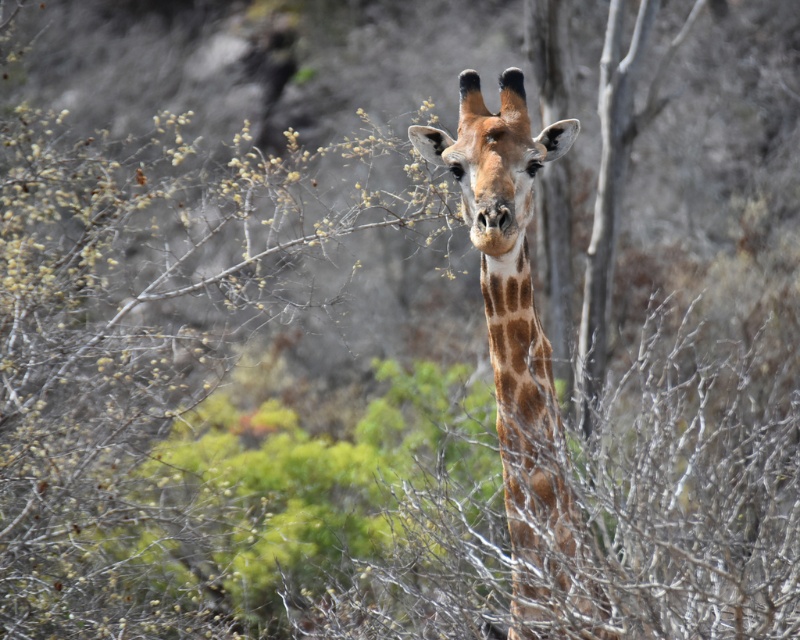
You are a wildlife photographer aiming to capture a closeup shot of the spotted fur giraffe head at center and the brown spotted neck at center. Given that your camera has a maximum focus range of 8 inches, will you be able to focus on both subjects simultaneously?

The spotted fur giraffe head at center and brown spotted neck at center are 8.18 inches apart. Since the distance between them exceeds the camera maximum focus range of 8 inches, you cannot focus on both subjects simultaneously.

In the scene shown: You are observing a giraffe in its natural habitat. There are two points marked on the giraffe, one at point (476, 177) and the other at point (486, 294). Which point is closer to your viewpoint?

Point (476, 177) is closer to the camera than point (486, 294).